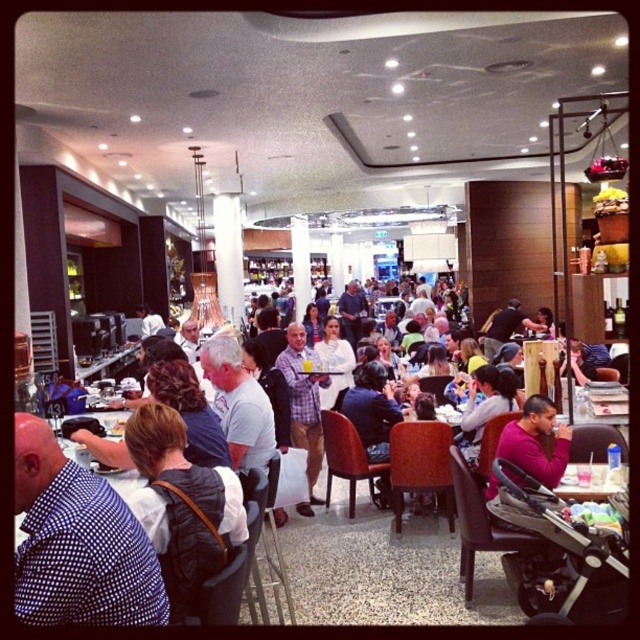
In the scene shown: You are standing at the entrance of the dining area and see the point marked at coordinates (77, 541). What object is located at that point?

The point at coordinates (77, 541) corresponds to the blue checkered shirt at lower left.

You are standing in the dining area and want to move towards the two points marked in the image. Which point, point (29, 417) or point (502, 326), will you reach first?

You will reach point (29, 417) first because it is closer to you than point (502, 326).

Looking at this image, you are a photographer setting up a camera on a tripod in the dining area. You need to position the camera so that both the purple sweater at center and the plaid shirt at center are fully visible in the frame. Considering their positions and sizes, which object should you ensure has more space allocated in your composition to avoid being cut off?

The purple sweater at center might be wider than plaid shirt at center, so you should allocate more space to the purple sweater at center in your composition to ensure it is fully visible without being cut off.